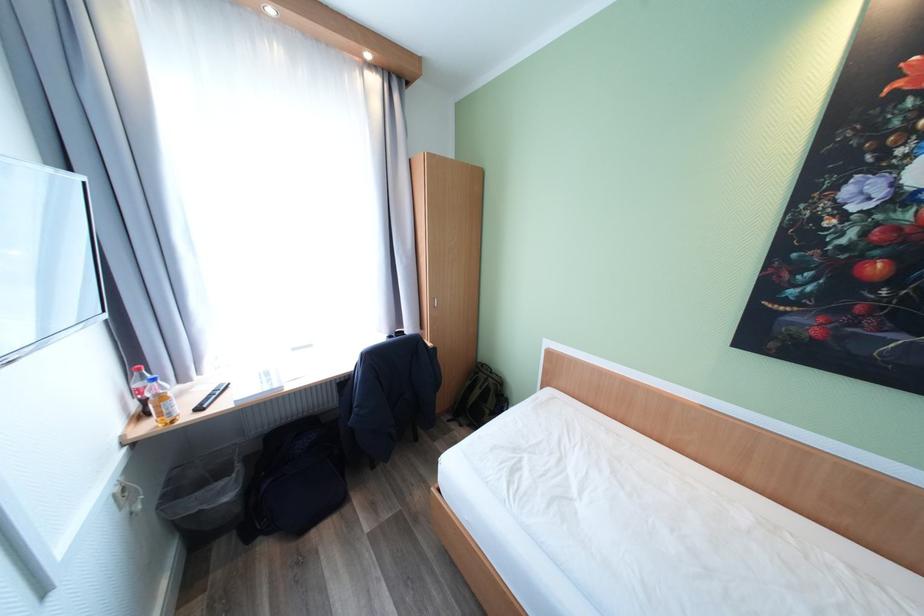
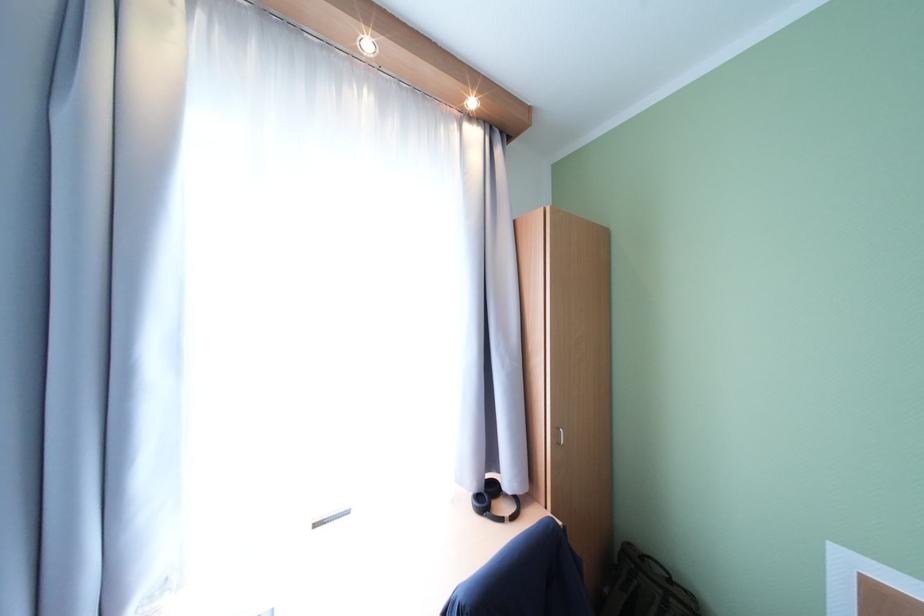
Where in the second image is the point corresponding to point 396,338 from the first image?

(484, 498)